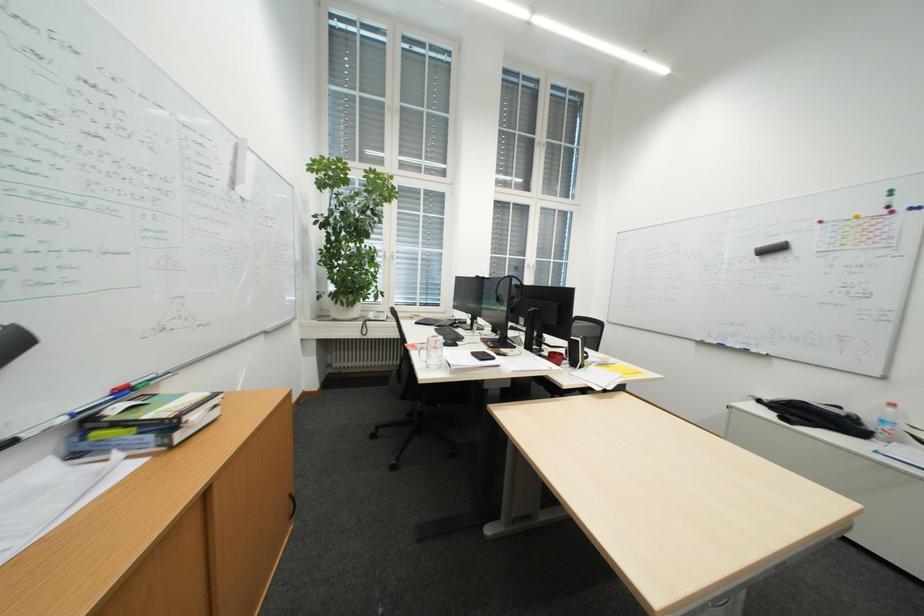
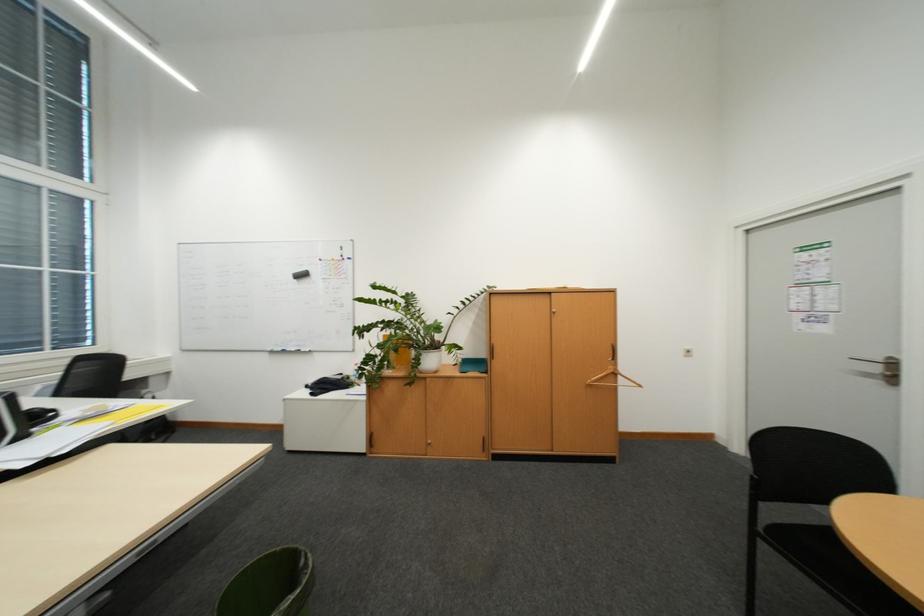
Question: How did the camera likely rotate?

Choices:
 (A) Left
 (B) Right
 (C) Up
 (D) Down

Answer: (B)